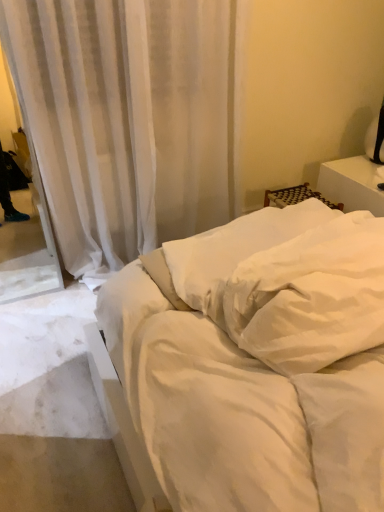
Question: Considering the relative sizes of white sheer curtain at upper center and white soft pillow at center, the first pillow positioned from the back, in the image provided, is white sheer curtain at upper center shorter than white soft pillow at center, the first pillow positioned from the back,?

Choices:
 (A) yes
 (B) no

Answer: (B)

Question: From a real-world perspective, is white sheer curtain at upper center under white soft pillow at center, the second pillow in the front-to-back sequence?

Choices:
 (A) yes
 (B) no

Answer: (B)

Question: Does white sheer curtain at upper center turn towards white soft pillow at center, the second pillow in the front-to-back sequence?

Choices:
 (A) no
 (B) yes

Answer: (B)

Question: Would you say white sheer curtain at upper center is outside white soft pillow at center, the first pillow positioned from the back?

Choices:
 (A) yes
 (B) no

Answer: (A)

Question: Can white soft pillow at center, the first pillow positioned from the back, be found inside white sheer curtain at upper center?

Choices:
 (A) no
 (B) yes

Answer: (A)

Question: Does white sheer curtain at upper center come behind white soft pillow at center, the second pillow in the front-to-back sequence?

Choices:
 (A) no
 (B) yes

Answer: (B)

Question: Can you confirm if white sheer curtain at upper center is shorter than white soft pillow at center, placed as the second pillow when sorted from back to front?

Choices:
 (A) no
 (B) yes

Answer: (A)

Question: Is white sheer curtain at upper center facing towards white soft pillow at center, placed as the first pillow when sorted from front to back?

Choices:
 (A) no
 (B) yes

Answer: (B)

Question: Considering the relative sizes of white sheer curtain at upper center and white soft pillow at center, placed as the second pillow when sorted from back to front, in the image provided, is white sheer curtain at upper center thinner than white soft pillow at center, placed as the second pillow when sorted from back to front,?

Choices:
 (A) yes
 (B) no

Answer: (A)

Question: Is white sheer curtain at upper center far from white soft pillow at center, placed as the second pillow when sorted from back to front?

Choices:
 (A) no
 (B) yes

Answer: (B)

Question: From a real-world perspective, is white sheer curtain at upper center physically above white soft pillow at center, placed as the second pillow when sorted from back to front?

Choices:
 (A) yes
 (B) no

Answer: (B)

Question: From the image's perspective, is white sheer curtain at upper center on top of white soft pillow at center, placed as the first pillow when sorted from front to back?

Choices:
 (A) yes
 (B) no

Answer: (A)

Question: Does white soft pillow at center, placed as the second pillow when sorted from back to front, touch white smooth bed at center?

Choices:
 (A) no
 (B) yes

Answer: (B)